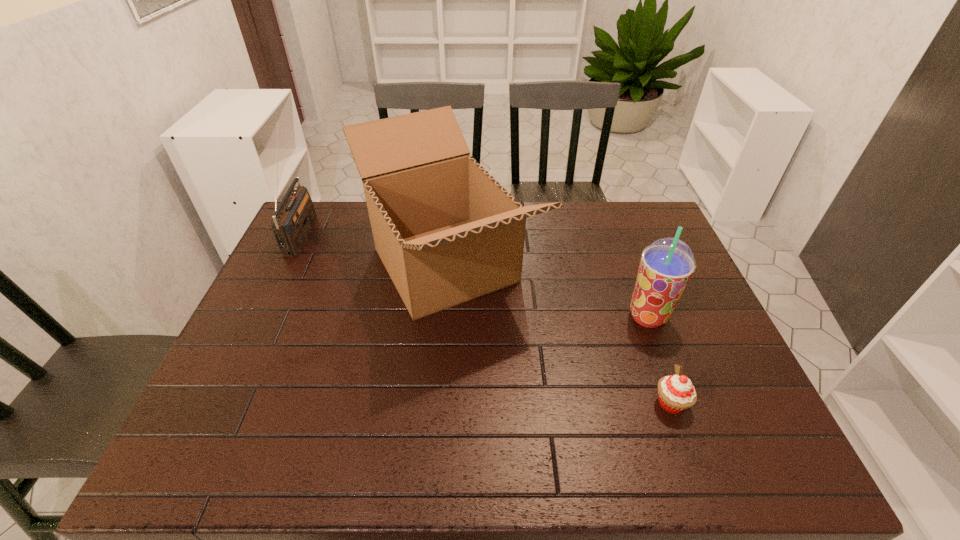
Where is `free space that satisfies the following two spatial constraints: 1. on the front side of the box; 2. on the right side of the smoothie`? The image size is (960, 540). free space that satisfies the following two spatial constraints: 1. on the front side of the box; 2. on the right side of the smoothie is located at coordinates (441, 316).

At what (x,y) coordinates should I click in order to perform the action: click on vacant point that satisfies the following two spatial constraints: 1. on the front-facing side of the radio receiver; 2. on the right side of the box. Please return your answer as a coordinate pair (x, y). The height and width of the screenshot is (540, 960). Looking at the image, I should click on (286, 265).

Identify the location of vacant area in the image that satisfies the following two spatial constraints: 1. on the front-facing side of the leftmost object; 2. on the left side of the box. This screenshot has width=960, height=540. (286, 265).

This screenshot has height=540, width=960. Find the location of `free space that satisfies the following two spatial constraints: 1. on the front-facing side of the radio receiver; 2. on the back side of the shortest object`. free space that satisfies the following two spatial constraints: 1. on the front-facing side of the radio receiver; 2. on the back side of the shortest object is located at coordinates (220, 403).

Image resolution: width=960 pixels, height=540 pixels. I want to click on free space that satisfies the following two spatial constraints: 1. on the front-facing side of the smoothie; 2. on the left side of the leftmost object, so click(261, 316).

I want to click on vacant area that satisfies the following two spatial constraints: 1. on the front-facing side of the leftmost object; 2. on the left side of the second object from left to right, so click(286, 265).

Locate an element on the screen. This screenshot has height=540, width=960. blank space that satisfies the following two spatial constraints: 1. on the front-facing side of the radio receiver; 2. on the right side of the smoothie is located at coordinates (261, 316).

At what (x,y) coordinates should I click in order to perform the action: click on free spot that satisfies the following two spatial constraints: 1. on the front-facing side of the cupcake; 2. on the right side of the leftmost object. Please return your answer as a coordinate pair (x, y). This screenshot has width=960, height=540. Looking at the image, I should click on (220, 403).

The height and width of the screenshot is (540, 960). What are the coordinates of `free location that satisfies the following two spatial constraints: 1. on the front-facing side of the box; 2. on the right side of the leftmost object` in the screenshot? It's located at (286, 265).